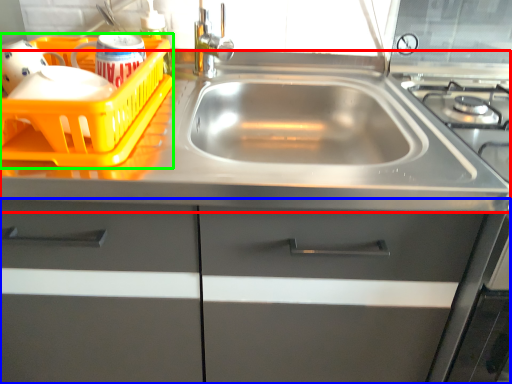
Question: Considering the real-world distances, which object is closest to counter top (highlighted by a red box)? cabinetry (highlighted by a blue box) or basket (highlighted by a green box).

Choices:
 (A) cabinetry
 (B) basket

Answer: (B)